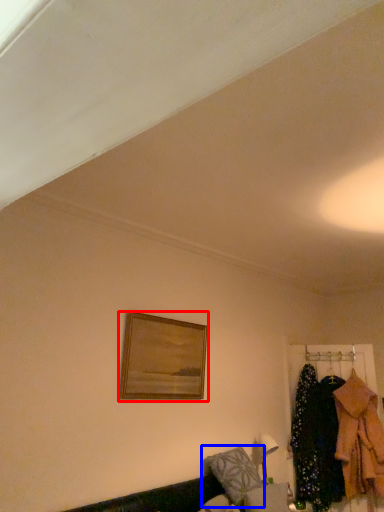
Question: Which of the following is the farthest to the observer, picture frame (highlighted by a red box) or pillow (highlighted by a blue box)?

Choices:
 (A) picture frame
 (B) pillow

Answer: (B)